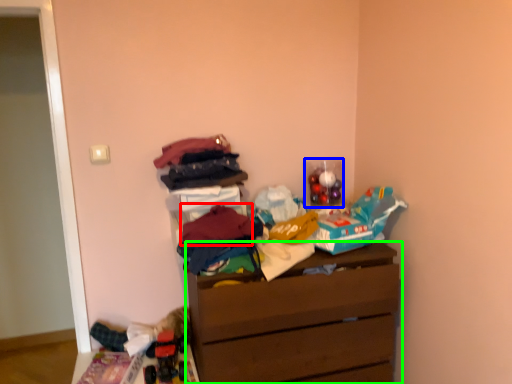
Question: Considering the real-world distances, which object is farthest from clothing (highlighted by a red box)? toy (highlighted by a blue box) or chest of drawers (highlighted by a green box)?

Choices:
 (A) toy
 (B) chest of drawers

Answer: (A)